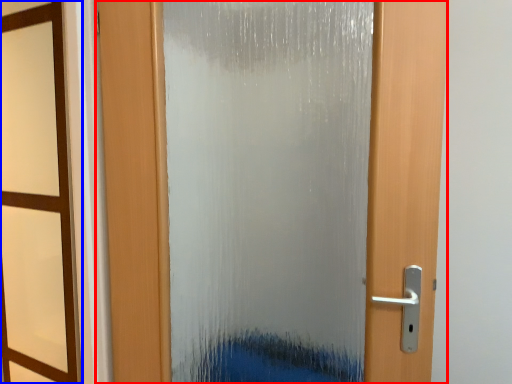
Question: Which object is further to the camera taking this photo, door (highlighted by a red box) or window frame (highlighted by a blue box)?

Choices:
 (A) door
 (B) window frame

Answer: (A)